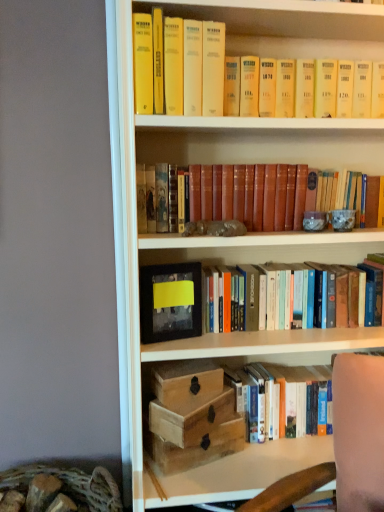
Question: Are leather-bound book at center, acting as the 1th book starting from the top, and matte black picture frame at center beside each other?

Choices:
 (A) yes
 (B) no

Answer: (B)

Question: From the image's perspective, is leather-bound book at center, arranged as the 3th book when ordered from the bottom, beneath matte black picture frame at center?

Choices:
 (A) no
 (B) yes

Answer: (A)

Question: Considering the relative sizes of leather-bound book at center, arranged as the 3th book when ordered from the bottom, and matte black picture frame at center in the image provided, is leather-bound book at center, arranged as the 3th book when ordered from the bottom, taller than matte black picture frame at center?

Choices:
 (A) no
 (B) yes

Answer: (A)

Question: Does leather-bound book at center, acting as the 1th book starting from the top, have a smaller size compared to matte black picture frame at center?

Choices:
 (A) yes
 (B) no

Answer: (B)

Question: Is the position of leather-bound book at center, arranged as the 3th book when ordered from the bottom, more distant than that of matte black picture frame at center?

Choices:
 (A) yes
 (B) no

Answer: (B)

Question: Is leather-bound book at center, arranged as the 3th book when ordered from the bottom, facing away from matte black picture frame at center?

Choices:
 (A) no
 (B) yes

Answer: (A)

Question: Can you confirm if wooden box at center is shorter than hardcover book at lower right, positioned as the 1th book in bottom-to-top order?

Choices:
 (A) yes
 (B) no

Answer: (A)

Question: Is wooden box at center positioned far away from hardcover book at lower right, positioned as the 1th book in bottom-to-top order?

Choices:
 (A) no
 (B) yes

Answer: (A)

Question: Considering the relative positions of wooden box at center and hardcover book at lower right, the third book viewed from the top, in the image provided, is wooden box at center to the left of hardcover book at lower right, the third book viewed from the top, from the viewer's perspective?

Choices:
 (A) yes
 (B) no

Answer: (A)

Question: Is wooden box at center to the right of hardcover book at lower right, the third book viewed from the top, from the viewer's perspective?

Choices:
 (A) yes
 (B) no

Answer: (B)

Question: Can you see wooden box at center touching hardcover book at lower right, the third book viewed from the top?

Choices:
 (A) no
 (B) yes

Answer: (A)

Question: Does wooden box at center have a greater height compared to hardcover book at lower right, positioned as the 1th book in bottom-to-top order?

Choices:
 (A) yes
 (B) no

Answer: (B)

Question: Is hardcover book at lower right, the third book viewed from the top, thinner than wooden box at center?

Choices:
 (A) yes
 (B) no

Answer: (B)